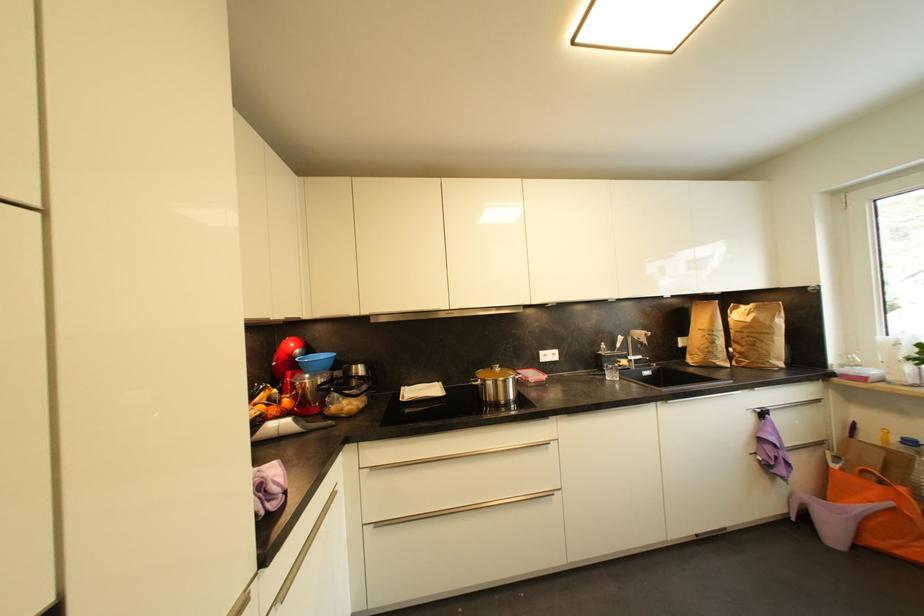
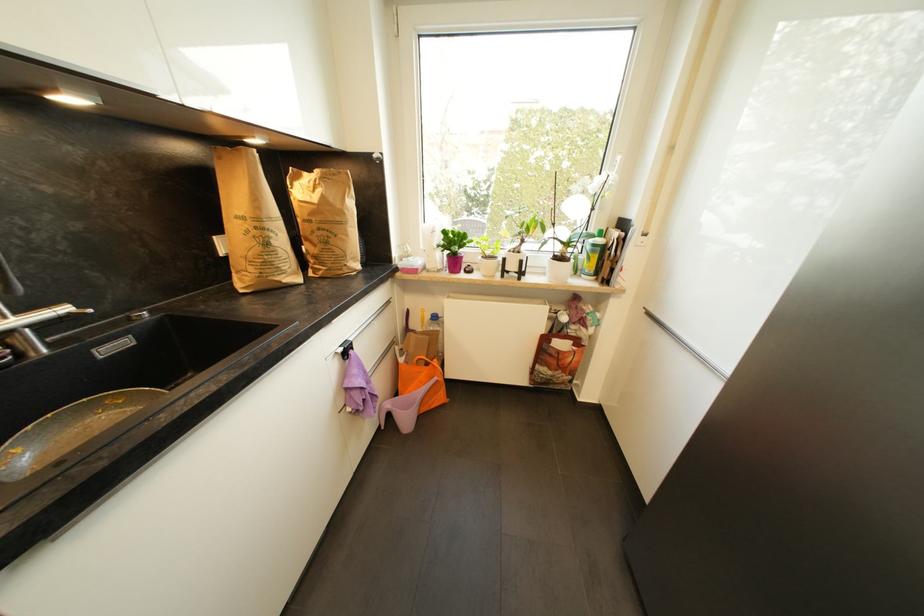
The point at (x=718, y=345) is marked in the first image. Where is the corresponding point in the second image?

(272, 246)